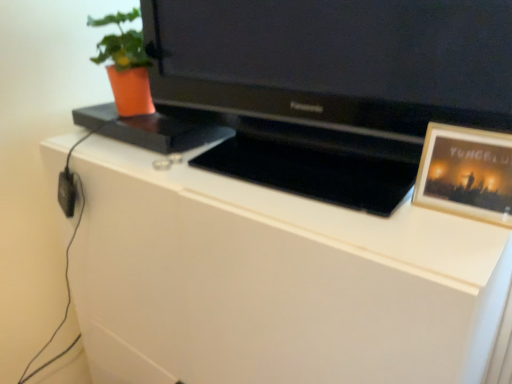
The width and height of the screenshot is (512, 384). In order to click on free spot in front of orange matte pot at upper left in this screenshot , I will do pyautogui.click(x=99, y=153).